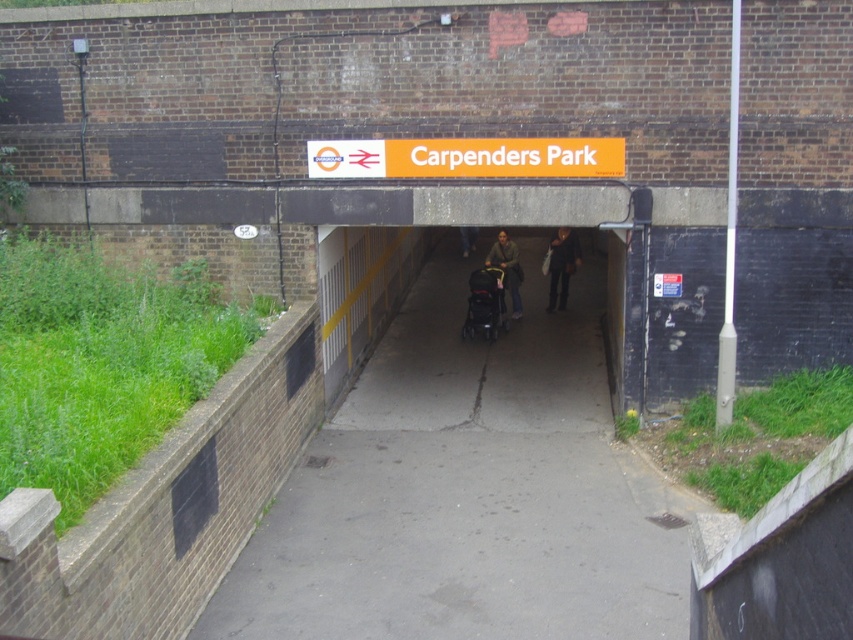
Question: Is black plastic baby carriage at center to the left of matte brown coat at center from the viewer's perspective?

Choices:
 (A) no
 (B) yes

Answer: (B)

Question: Can you confirm if concrete sidewalk at center is thinner than dark blue jeans at center?

Choices:
 (A) no
 (B) yes

Answer: (A)

Question: Is orange plastic sign at upper center closer to the viewer compared to dark blue jeans at center?

Choices:
 (A) no
 (B) yes

Answer: (B)

Question: Which point is closer to the camera taking this photo?

Choices:
 (A) coord(335,426)
 (B) coord(465,240)

Answer: (A)

Question: Based on their relative distances, which object is nearer to the black plastic baby carriage at center?

Choices:
 (A) matte brown coat at center
 (B) dark blue jeans at center
 (C) orange plastic sign at upper center
 (D) concrete sidewalk at center

Answer: (A)

Question: Among these objects, which one is farthest from the camera?

Choices:
 (A) black plastic baby carriage at center
 (B) matte brown coat at center
 (C) dark gray fabric jacket at center

Answer: (C)